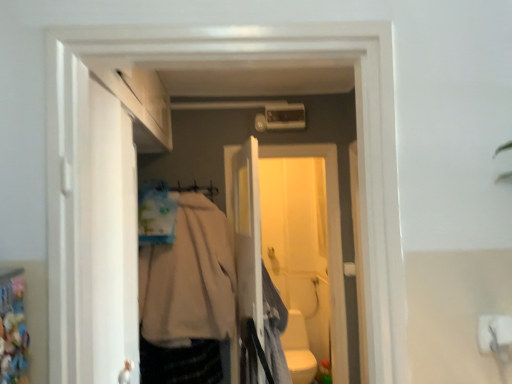
Question: From the image's perspective, is white matte door at left located beneath white plastic screen door at center, which is counted as the first screen door, starting from the front?

Choices:
 (A) no
 (B) yes

Answer: (A)

Question: Considering the relative sizes of white matte door at left and white plastic screen door at center, which is counted as the first screen door, starting from the front, in the image provided, is white matte door at left thinner than white plastic screen door at center, which is counted as the first screen door, starting from the front,?

Choices:
 (A) no
 (B) yes

Answer: (A)

Question: From the image's perspective, is white matte door at left on top of white plastic screen door at center, which ranks as the second screen door in back-to-front order?

Choices:
 (A) no
 (B) yes

Answer: (B)

Question: Considering the relative sizes of white matte door at left and white plastic screen door at center, which ranks as the second screen door in back-to-front order, in the image provided, is white matte door at left shorter than white plastic screen door at center, which ranks as the second screen door in back-to-front order,?

Choices:
 (A) yes
 (B) no

Answer: (A)

Question: Does white matte door at left turn towards white plastic screen door at center, which ranks as the second screen door in back-to-front order?

Choices:
 (A) yes
 (B) no

Answer: (B)

Question: Is white glossy toilet bowl at lower center bigger or smaller than beige fabric hanger at center?

Choices:
 (A) small
 (B) big

Answer: (B)

Question: Is white glossy toilet bowl at lower center inside or outside of beige fabric hanger at center?

Choices:
 (A) outside
 (B) inside

Answer: (A)

Question: Looking at their shapes, would you say white glossy toilet bowl at lower center is wider or thinner than beige fabric hanger at center?

Choices:
 (A) thin
 (B) wide

Answer: (B)

Question: From a real-world perspective, relative to beige fabric hanger at center, is white glossy toilet bowl at lower center vertically above or below?

Choices:
 (A) above
 (B) below

Answer: (B)

Question: Is point (211, 193) closer or farther from the camera than point (104, 340)?

Choices:
 (A) closer
 (B) farther

Answer: (B)

Question: From the image's perspective, relative to white matte door at left, is beige fabric hanger at center above or below?

Choices:
 (A) below
 (B) above

Answer: (B)

Question: Is beige fabric hanger at center in front of or behind white matte door at left in the image?

Choices:
 (A) front
 (B) behind

Answer: (B)

Question: Considering the positions of beige fabric hanger at center and white matte door at left in the image, is beige fabric hanger at center bigger or smaller than white matte door at left?

Choices:
 (A) small
 (B) big

Answer: (A)

Question: From the image's perspective, is white matte door at left above or below beige fabric coat at center, acting as the first clothing starting from the left?

Choices:
 (A) below
 (B) above

Answer: (B)

Question: Is white matte door at left to the left or to the right of beige fabric coat at center, acting as the first clothing starting from the left, in the image?

Choices:
 (A) left
 (B) right

Answer: (A)